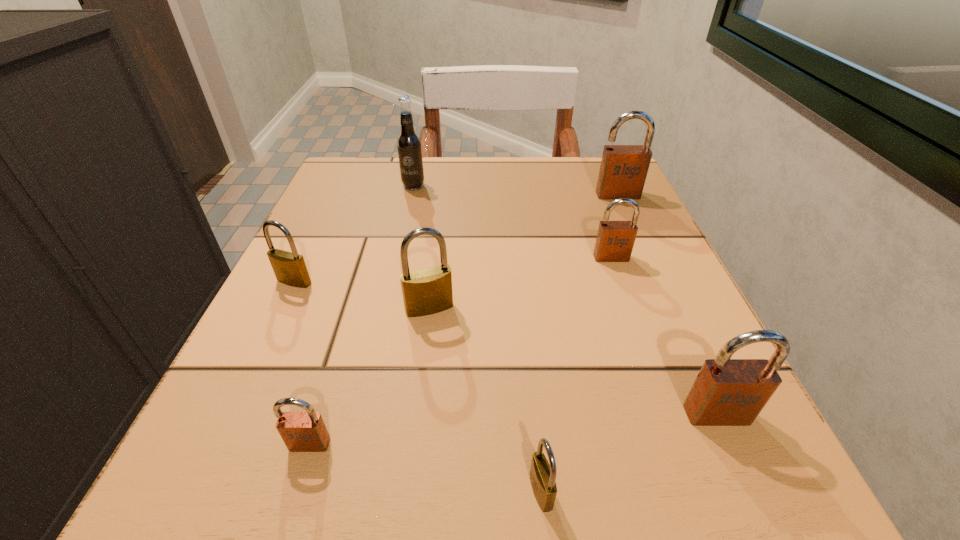
At what (x,y) coordinates should I click in order to perform the action: click on vacant area in the image that satisfies the following two spatial constraints: 1. on the label of the root beer; 2. on the right side of the fifth padlock from right to left. Please return your answer as a coordinate pair (x, y). Looking at the image, I should click on (386, 308).

Find the location of a particular element. The height and width of the screenshot is (540, 960). vacant space that satisfies the following two spatial constraints: 1. on the label of the sixth object from right to left; 2. on the right side of the fourth object from right to left is located at coordinates (345, 491).